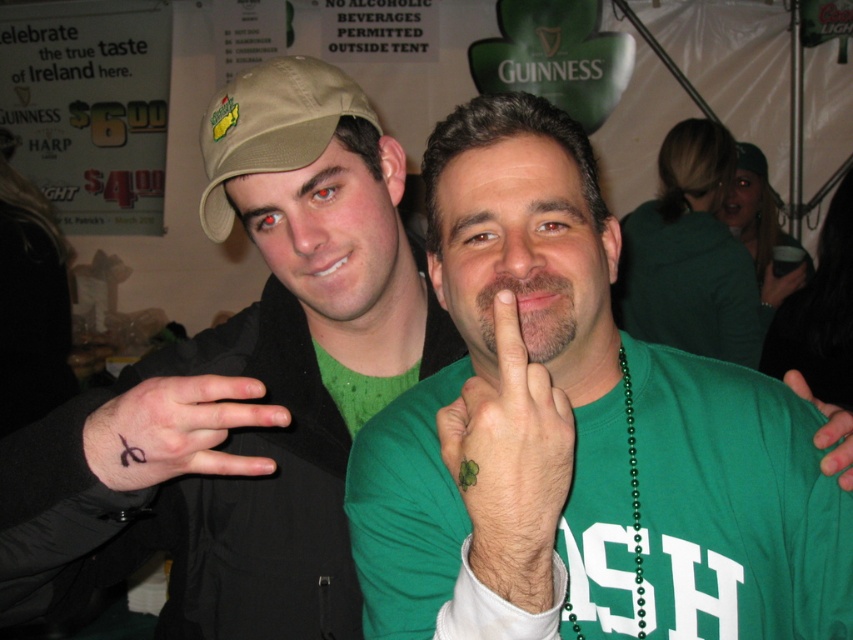
Question: Is green matte shirt at center wider than green matte hand at center?

Choices:
 (A) no
 (B) yes

Answer: (B)

Question: Estimate the real-world distances between objects in this image. Which object is closer to the green matte shirt at center?

Choices:
 (A) green fabric at center
 (B) black ink tattoo at left

Answer: (B)

Question: Considering the real-world distances, which object is farthest from the green matte hand at center?

Choices:
 (A) matte green shirt at center
 (B) green fabric at center
 (C) green matte shirt at center

Answer: (B)

Question: Is green matte shirt at center wider than tan fabric baseball cap at upper left?

Choices:
 (A) yes
 (B) no

Answer: (A)

Question: Which point is farther to the camera?

Choices:
 (A) green matte shirt at center
 (B) tan fabric baseball cap at upper left
 (C) green matte hand at center

Answer: (B)

Question: Can you confirm if matte green shirt at center is thinner than green fabric at center?

Choices:
 (A) no
 (B) yes

Answer: (A)